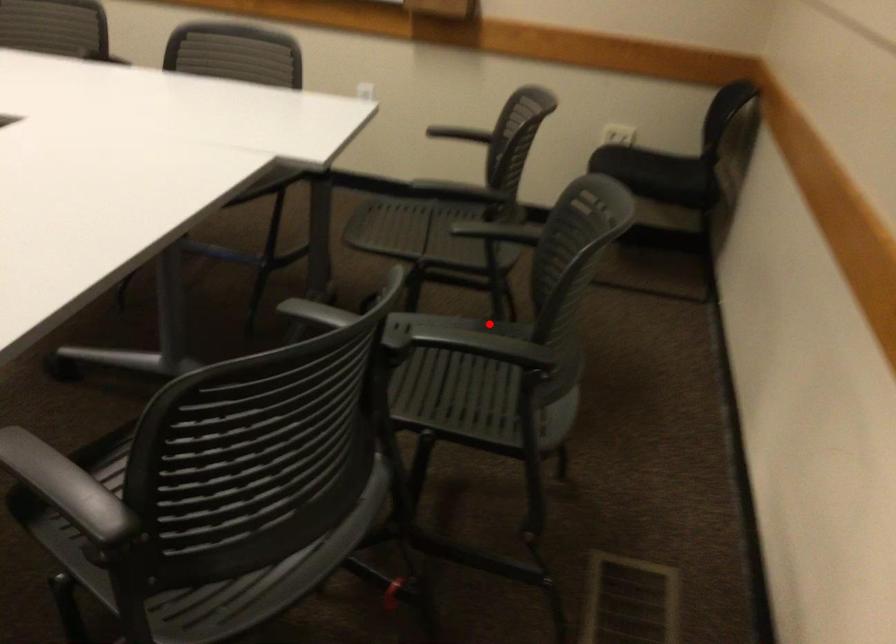
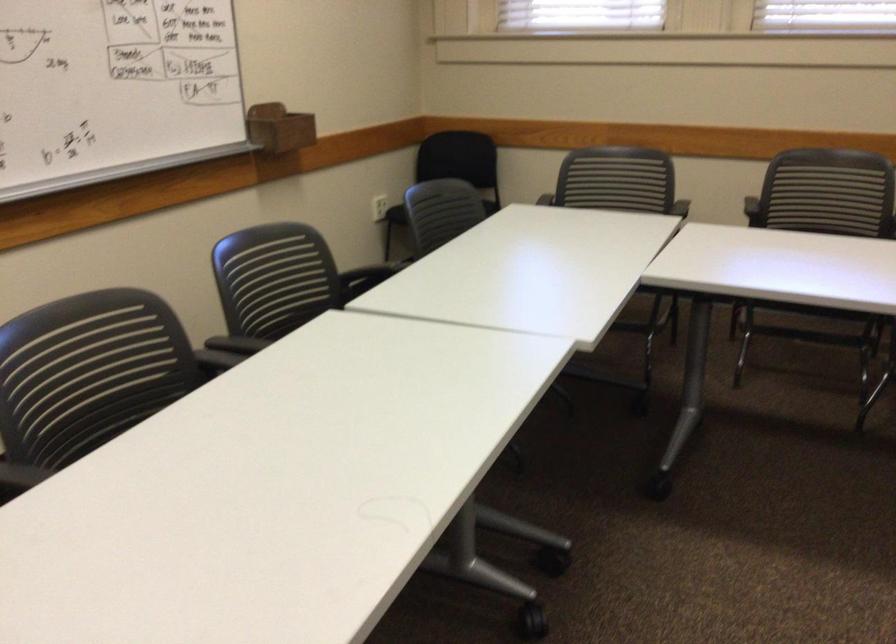
Question: I am providing you with two images of the same scene from different viewpoints. A red point is marked on the first image. Is the red point's position out of view in image 2?

Choices:
 (A) Yes
 (B) No

Answer: (A)